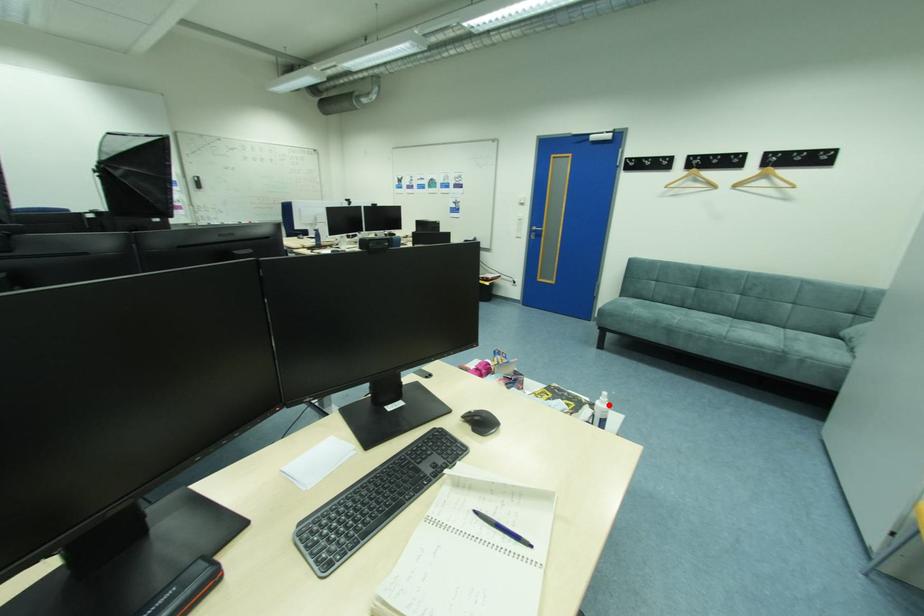
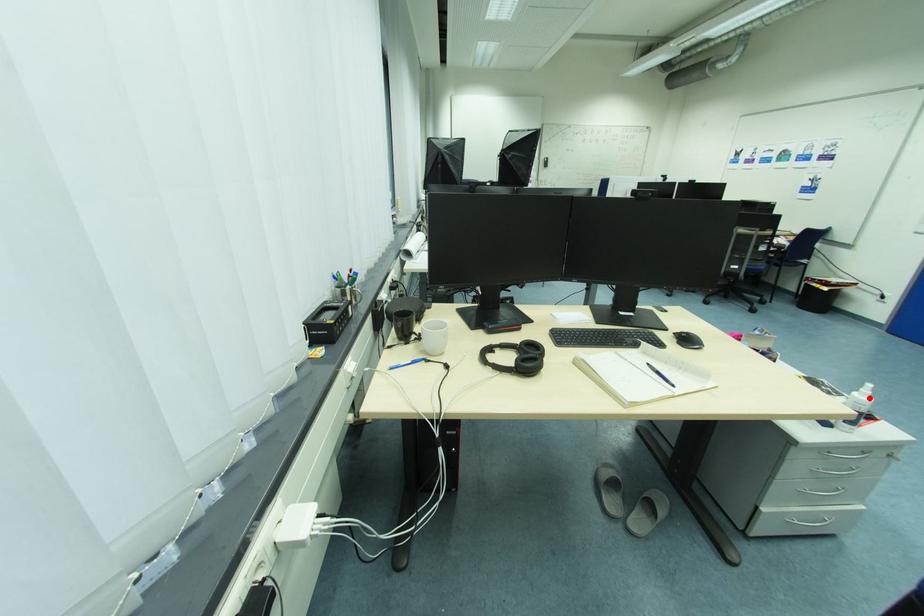
I am providing you with two images of the same scene from different viewpoints. A red point is marked on the first image and another point is marked on the second image. Do the highlighted points in image1 and image2 indicate the same real-world spot?

Yes